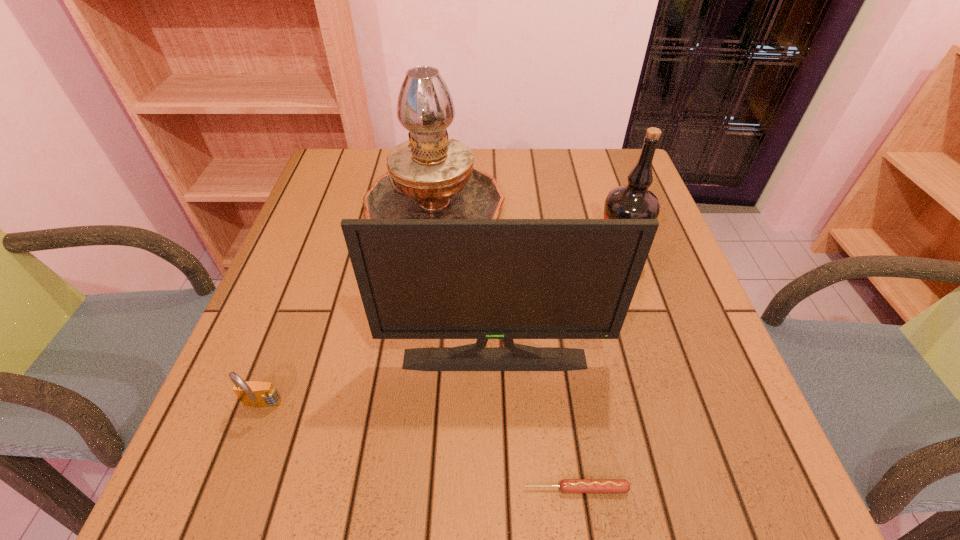
The height and width of the screenshot is (540, 960). Identify the location of free space in the image that satisfies the following two spatial constraints: 1. on the front-facing side of the nearest object; 2. on the right side of the third nearest object. (497, 489).